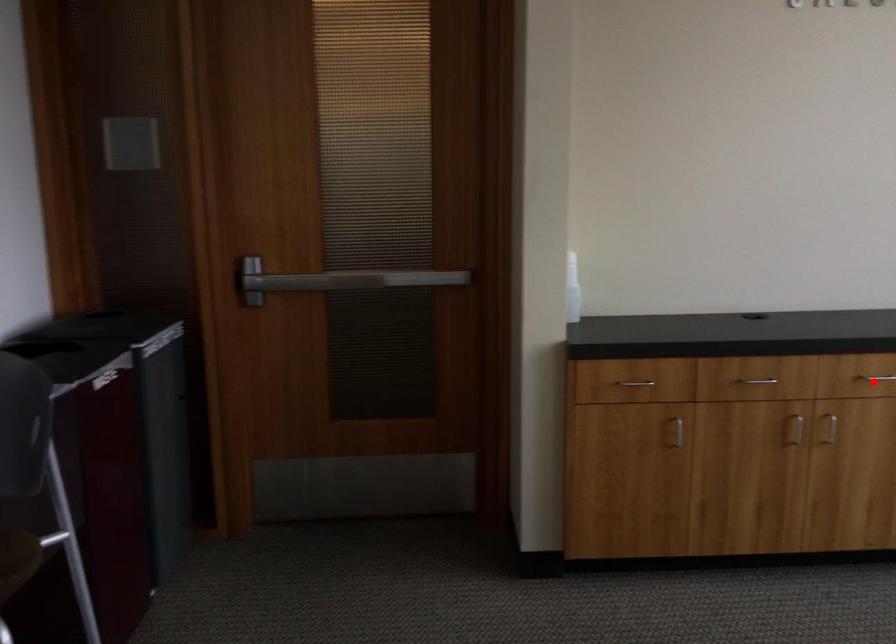
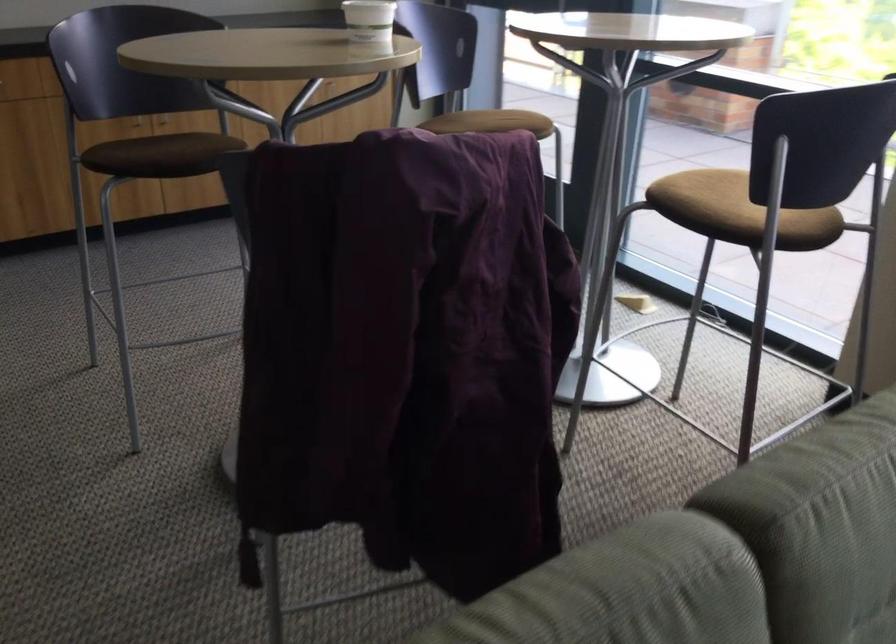
Question: I am providing you with two images of the same scene from different viewpoints. A red point is marked on the first image. Can you still see the location of the red point in image 2?

Choices:
 (A) Yes
 (B) No

Answer: (B)